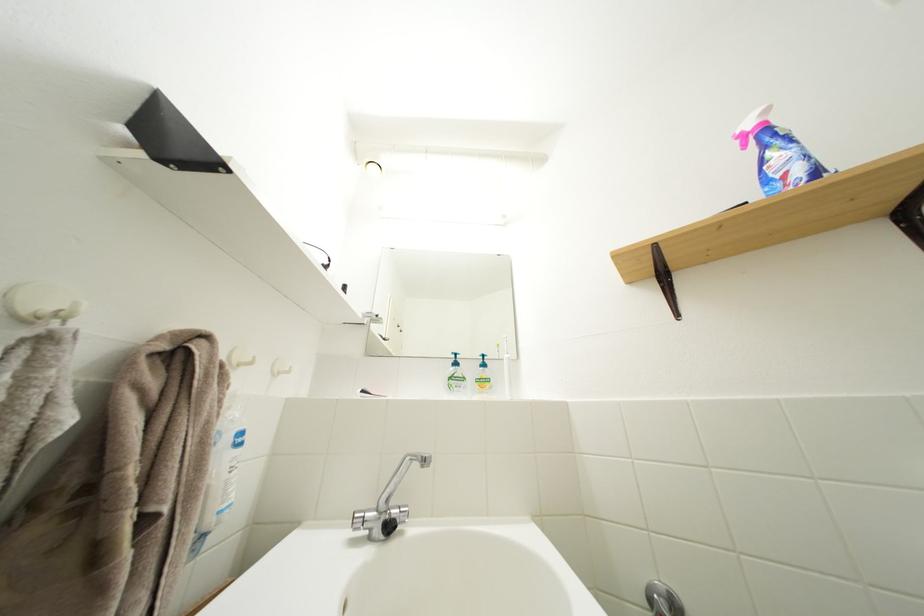
Find the location of `black water knob`. black water knob is located at coordinates (388, 525).